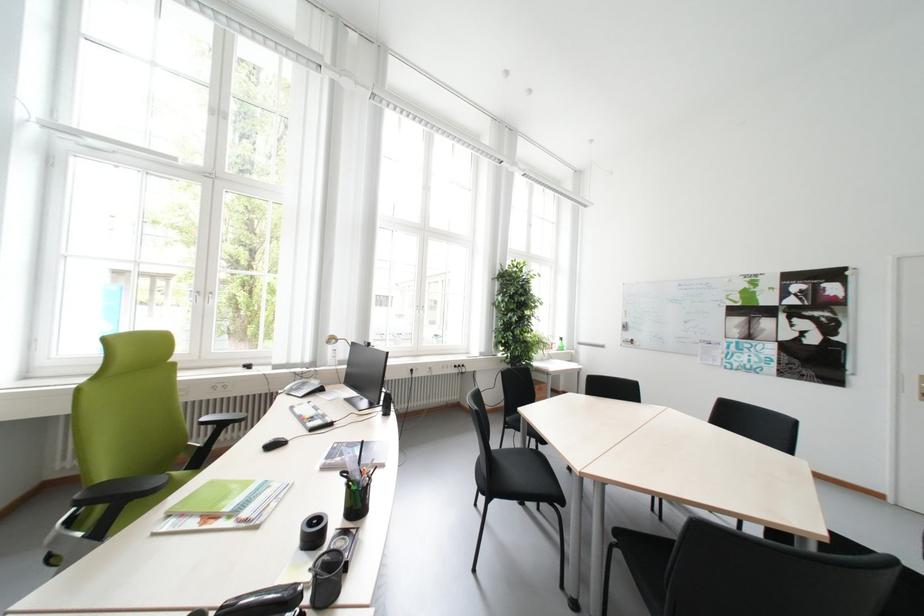
Where would you lift the black pen holder? Please return your answer as a coordinate pair (x, y).

(357, 487)